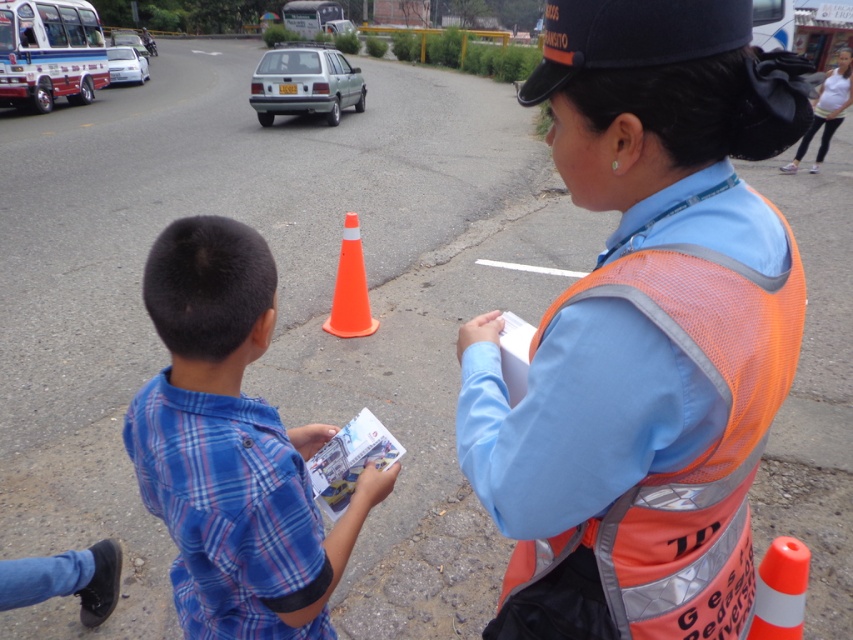
You are a delivery drone operator and need to drop a package to the person wearing the blue plaid shirt at center. The drone can only drop the package at the exact coordinates provided. What are the coordinates where you should drop the package?

The coordinates for the blue plaid shirt at center are at point (231,448), so you should drop the package there.

You are a delivery driver approaching the scene. The traffic officer is on the right and the boy is on the left. There is an orange reflective cone marked by point (780, 589). To safely navigate around the cone, which direction should you turn your vehicle?

The orange reflective cone at center is represented by point (780, 589). To safely navigate around it, you should turn your vehicle to the right or left, keeping a safe distance from the cone and following the traffic officer instructions.

You are a pedestrian trying to cross the road where the orange reflective vest at center and the blue plaid shirt at center are located. Which individual should you look towards first before proceeding?

You should look towards the orange reflective vest at center first because it is in front of the blue plaid shirt at center, making it closer to your path.